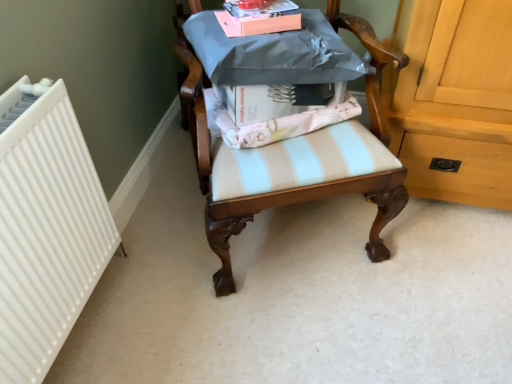
You are a GUI agent. You are given a task and a screenshot of the screen. Output one action in this format:
    pyautogui.click(x=<x>, y=<y>)
    Task: Click on the unoccupied region to the right of wooden chair at center
    
    Given the screenshot: What is the action you would take?
    pyautogui.click(x=445, y=261)